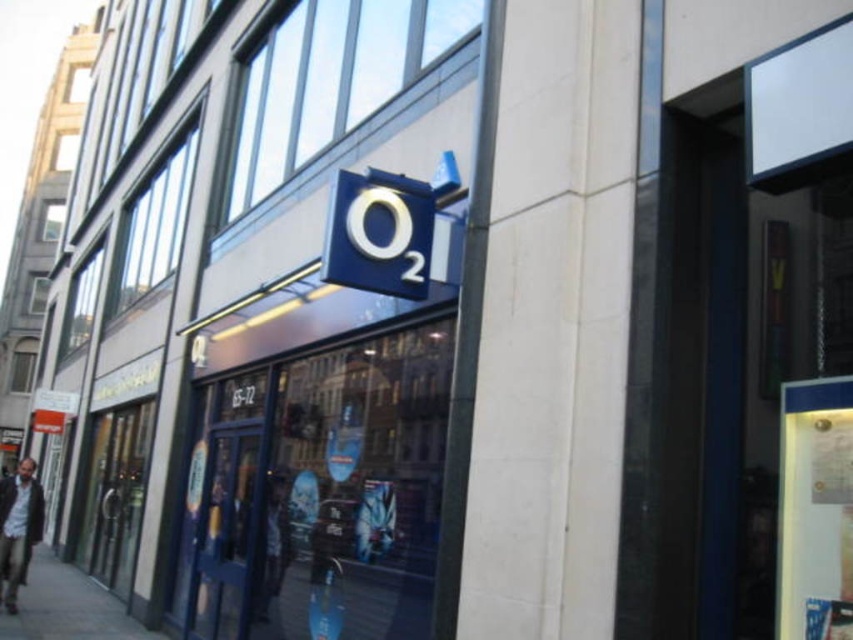
Question: Which object is positioned farthest from the dark blue fabric jacket at center?

Choices:
 (A) dark brown leather jacket at lower left
 (B) concrete sidewalk at lower left

Answer: (A)

Question: Does concrete sidewalk at lower left appear on the right side of dark blue fabric jacket at center?

Choices:
 (A) yes
 (B) no

Answer: (B)

Question: Which of the following is the farthest from the observer?

Choices:
 (A) dark blue fabric jacket at center
 (B) dark brown leather jacket at lower left

Answer: (B)

Question: Is dark brown leather jacket at lower left further to camera compared to dark blue fabric jacket at center?

Choices:
 (A) yes
 (B) no

Answer: (A)

Question: Does concrete sidewalk at lower left appear on the left side of dark blue fabric jacket at center?

Choices:
 (A) yes
 (B) no

Answer: (A)

Question: Among these points, which one is farthest from the camera?

Choices:
 (A) (91, 625)
 (B) (268, 588)
 (C) (28, 512)

Answer: (C)